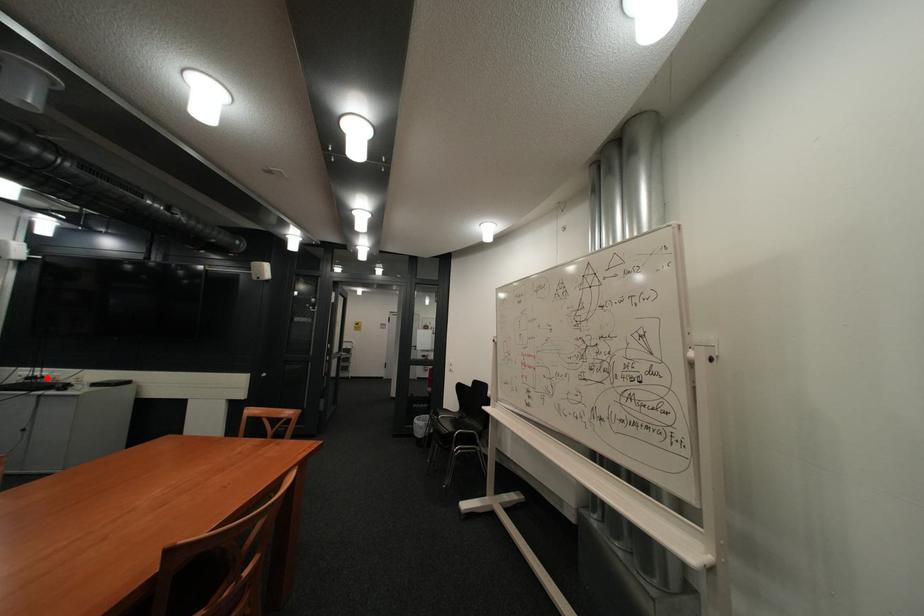
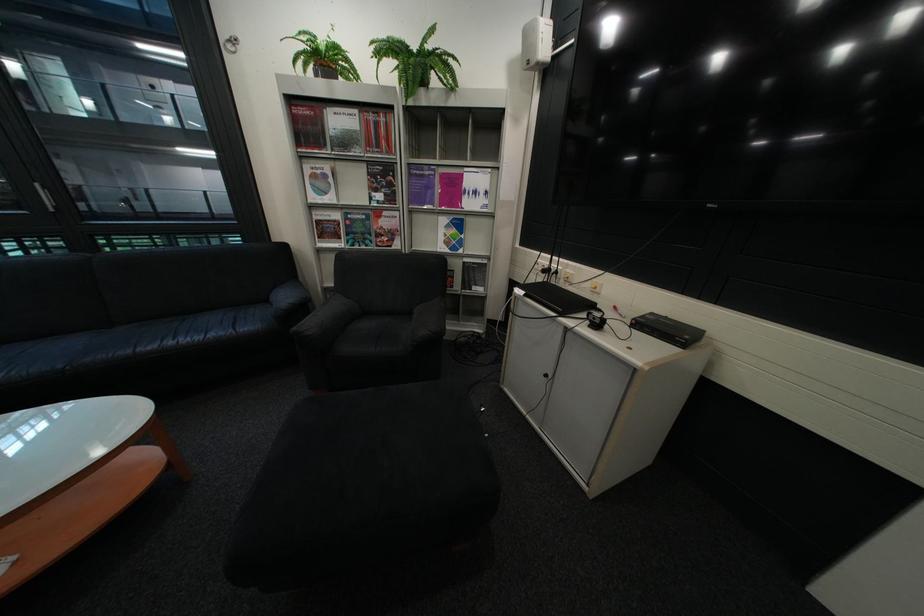
The point at the highlighted location is marked in the first image. Where is the corresponding point in the second image?

(563, 270)